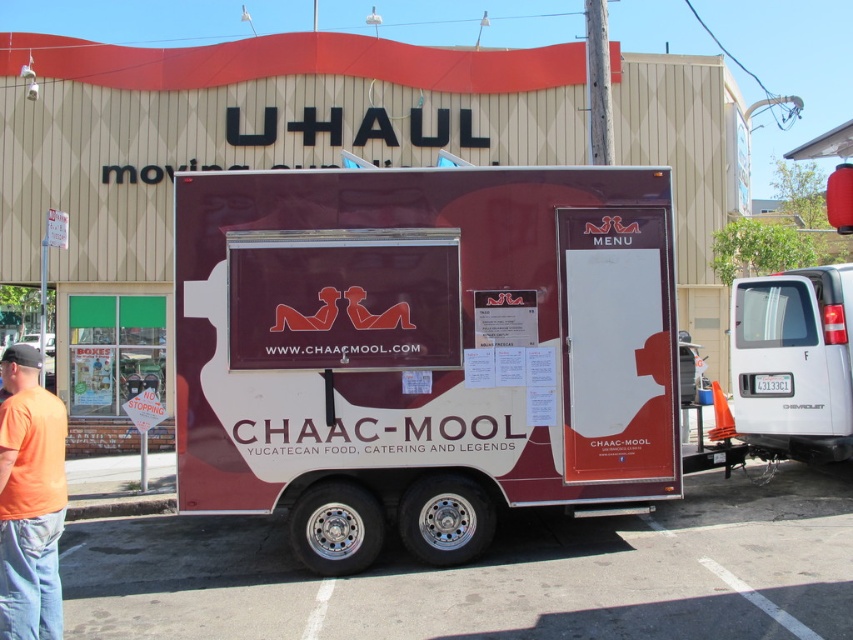
Who is higher up, maroon matte food truck at center or white glossy van at right?

maroon matte food truck at center is higher up.

Describe the element at coordinates (422, 349) in the screenshot. I see `maroon matte food truck at center` at that location.

Is point (645, 314) behind point (815, 348)?

No, it is not.

In order to click on maroon matte food truck at center in this screenshot , I will do `click(422, 349)`.

Can you confirm if maroon matte food truck at center is taller than orange t-shirt at left?

Yes, maroon matte food truck at center is taller than orange t-shirt at left.

Does maroon matte food truck at center come behind orange t-shirt at left?

Yes, it is behind orange t-shirt at left.

Is point (526, 452) closer to viewer compared to point (50, 449)?

No, (526, 452) is further to viewer.

At what (x,y) coordinates should I click in order to perform the action: click on maroon matte food truck at center. Please return your answer as a coordinate pair (x, y). The width and height of the screenshot is (853, 640). Looking at the image, I should click on (422, 349).

Does white glossy van at right have a larger size compared to orange t-shirt at left?

Indeed, white glossy van at right has a larger size compared to orange t-shirt at left.

Find the location of `white glossy van at right`. white glossy van at right is located at coordinates (793, 362).

You are a GUI agent. You are given a task and a screenshot of the screen. Output one action in this format:
    pyautogui.click(x=<x>, y=<y>)
    Task: Click on the white glossy van at right
    
    Given the screenshot: What is the action you would take?
    (793, 362)